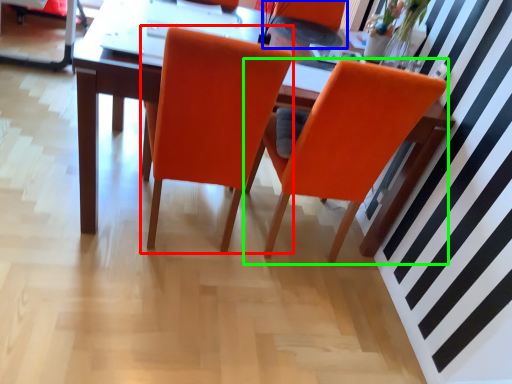
Question: Which object is positioned farthest from chair (highlighted by a red box)? Select from armchair (highlighted by a blue box) and chair (highlighted by a green box).

Choices:
 (A) armchair
 (B) chair

Answer: (A)